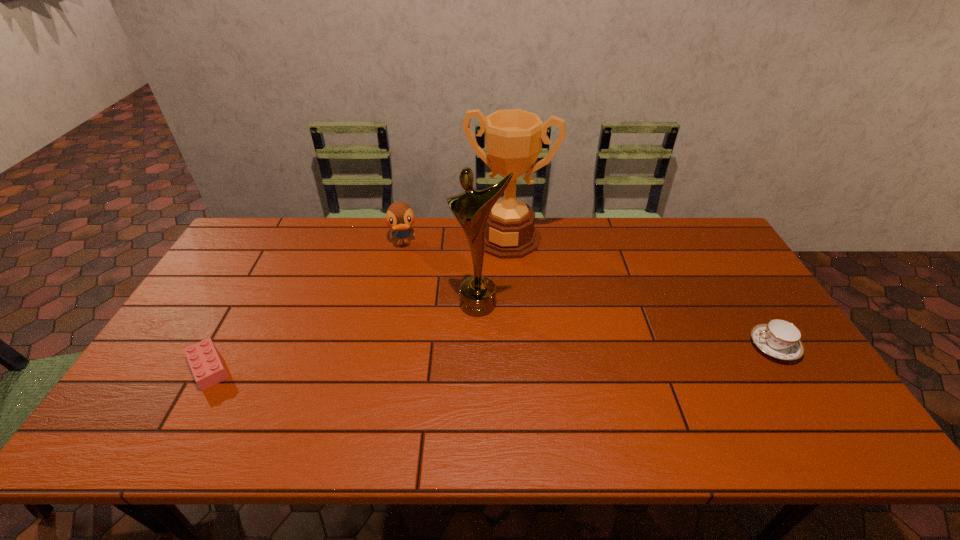
Image resolution: width=960 pixels, height=540 pixels. Identify the location of free spot on the desktop that is between the shortest object and the fourth tallest object and is positioned on the front-facing side of the farther award. coord(464,358).

Locate an element on the screen. The width and height of the screenshot is (960, 540). free space on the desktop that is between the leftmost object and the teacup and is positioned on the front-facing side of the duck is located at coordinates (414, 360).

You are a GUI agent. You are given a task and a screenshot of the screen. Output one action in this format:
    pyautogui.click(x=<x>, y=<y>)
    Task: Click on the free space on the desktop that is between the shortest object and the teacup and is positioned on the front-facing side of the third farthest object
    
    Given the screenshot: What is the action you would take?
    pyautogui.click(x=452, y=359)